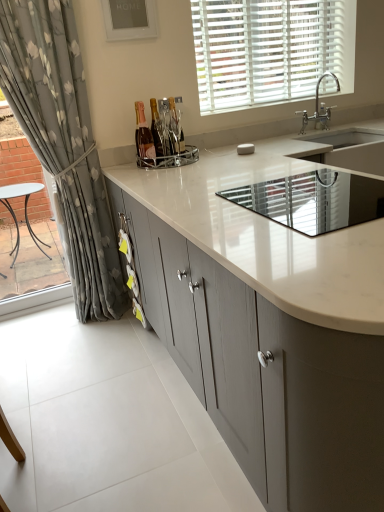
Image resolution: width=384 pixels, height=512 pixels. I want to click on vacant space underneath floral fabric curtain at left (from a real-world perspective), so click(82, 325).